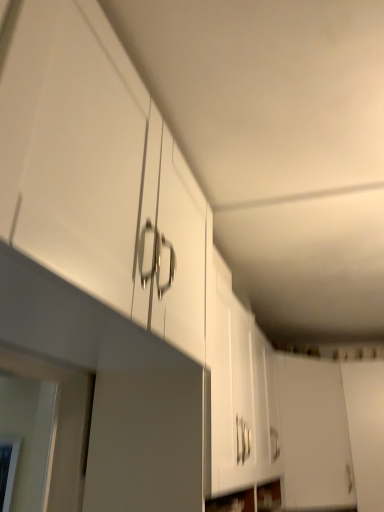
Question: From a real-world perspective, is white matte cabinet door at lower right, the first door positioned from the left, located higher than white matte door at lower right, arranged as the first door when viewed from the right?

Choices:
 (A) yes
 (B) no

Answer: (A)

Question: Is white matte cabinet door at lower right, the first door positioned from the left, oriented towards white matte door at lower right, acting as the 2th door starting from the left?

Choices:
 (A) yes
 (B) no

Answer: (B)

Question: Considering the relative sizes of white matte cabinet door at lower right, positioned as the 2th door in right-to-left order, and white matte door at lower right, arranged as the first door when viewed from the right, in the image provided, is white matte cabinet door at lower right, positioned as the 2th door in right-to-left order, taller than white matte door at lower right, arranged as the first door when viewed from the right,?

Choices:
 (A) no
 (B) yes

Answer: (A)

Question: Would you say white matte door at lower right, acting as the 2th door starting from the left, is part of white matte cabinet door at lower right, the first door positioned from the left,'s contents?

Choices:
 (A) no
 (B) yes

Answer: (A)

Question: Is white matte cabinet door at lower right, positioned as the 2th door in right-to-left order, positioned far away from white matte door at lower right, arranged as the first door when viewed from the right?

Choices:
 (A) no
 (B) yes

Answer: (A)

Question: Considering the relative sizes of white matte cabinet door at lower right, the first door positioned from the left, and white matte door at lower right, acting as the 2th door starting from the left, in the image provided, is white matte cabinet door at lower right, the first door positioned from the left, smaller than white matte door at lower right, acting as the 2th door starting from the left,?

Choices:
 (A) yes
 (B) no

Answer: (B)

Question: Does white matte cabinet door at lower right, the first door positioned from the left, come behind white glossy cabinet at upper left?

Choices:
 (A) no
 (B) yes

Answer: (B)

Question: Does white matte cabinet door at lower right, positioned as the 2th door in right-to-left order, appear on the right side of white glossy cabinet at upper left?

Choices:
 (A) no
 (B) yes

Answer: (B)

Question: From a real-world perspective, is white matte cabinet door at lower right, the first door positioned from the left, located higher than white glossy cabinet at upper left?

Choices:
 (A) yes
 (B) no

Answer: (B)

Question: Is white matte cabinet door at lower right, the first door positioned from the left, to the left of white glossy cabinet at upper left from the viewer's perspective?

Choices:
 (A) yes
 (B) no

Answer: (B)

Question: Does white matte cabinet door at lower right, positioned as the 2th door in right-to-left order, have a greater height compared to white glossy cabinet at upper left?

Choices:
 (A) no
 (B) yes

Answer: (B)

Question: Is white matte cabinet door at lower right, the first door positioned from the left, next to white glossy cabinet at upper left?

Choices:
 (A) no
 (B) yes

Answer: (A)

Question: Is white glossy cabinet at upper left at the left side of white matte door at lower right, arranged as the first door when viewed from the right?

Choices:
 (A) yes
 (B) no

Answer: (A)